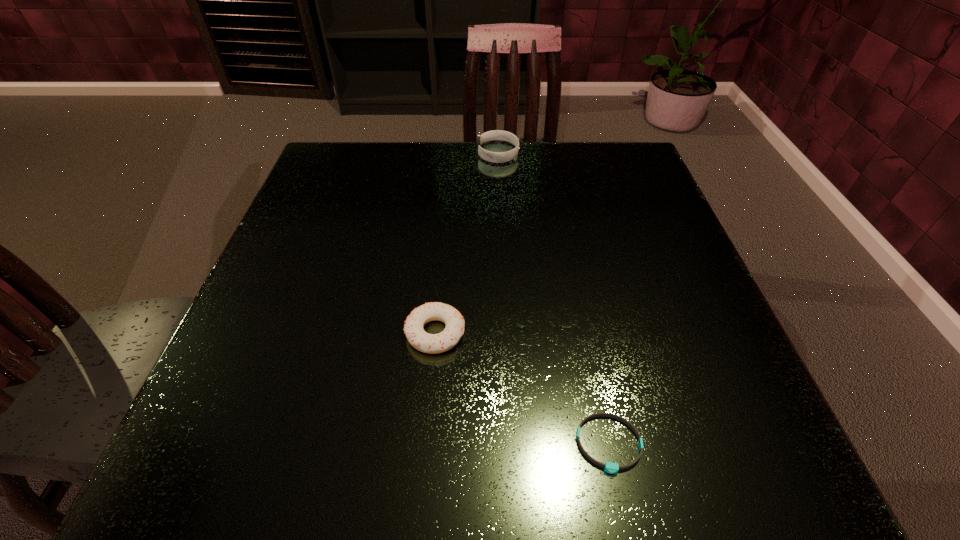
Where is `free area in between the nearest object and the tallest object`? The height and width of the screenshot is (540, 960). free area in between the nearest object and the tallest object is located at coordinates (553, 299).

Where is `unoccupied position between the left wristband and the rightmost object`? unoccupied position between the left wristband and the rightmost object is located at coordinates tap(553, 299).

The image size is (960, 540). I want to click on empty location between the doughnut and the taller wristband, so click(x=467, y=243).

This screenshot has height=540, width=960. In order to click on free area in between the right wristband and the second shortest object in this screenshot , I will do `click(522, 388)`.

The width and height of the screenshot is (960, 540). I want to click on free space between the tallest object and the second nearest object, so click(467, 243).

Where is `unoccupied position between the tallest object and the second farthest object`? This screenshot has width=960, height=540. unoccupied position between the tallest object and the second farthest object is located at coordinates (467, 243).

Locate an element on the screen. free spot between the nearest object and the second shortest object is located at coordinates (522, 388).

The width and height of the screenshot is (960, 540). What are the coordinates of `unoccupied position between the left wristband and the second shortest object` in the screenshot? It's located at (467, 243).

Locate an element on the screen. free point between the doughnut and the second object from right to left is located at coordinates (467, 243).

Find the location of a particular element. The width and height of the screenshot is (960, 540). object that ranks as the second closest to the farther wristband is located at coordinates (609, 467).